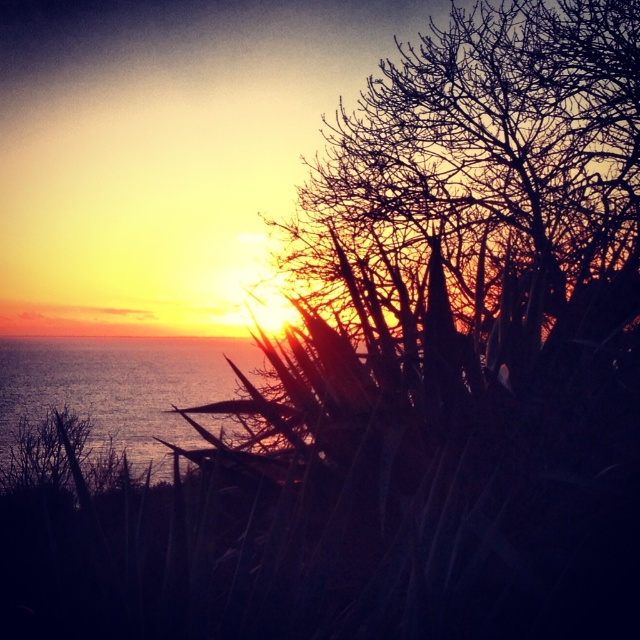
Is bare branches at upper right shorter than shiny blue water at left?

In fact, bare branches at upper right may be taller than shiny blue water at left.

Who is more forward, (390, 186) or (163, 396)?

Point (390, 186) is in front.

What do you see at coordinates (500, 157) in the screenshot? I see `bare branches at upper right` at bounding box center [500, 157].

Where is `bare branches at upper right`? bare branches at upper right is located at coordinates (500, 157).